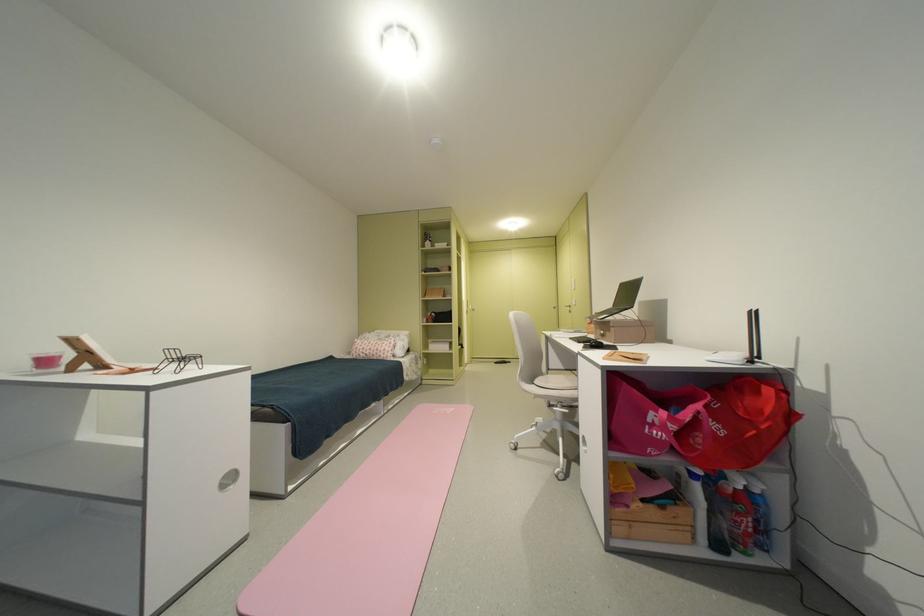
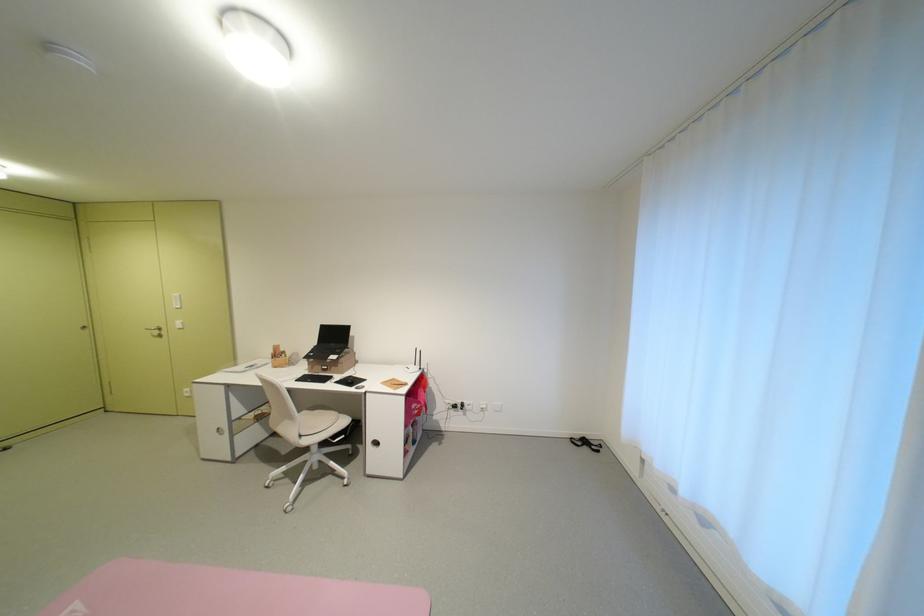
Find the pixel in the second image that matches point (618, 331) in the first image.

(346, 368)